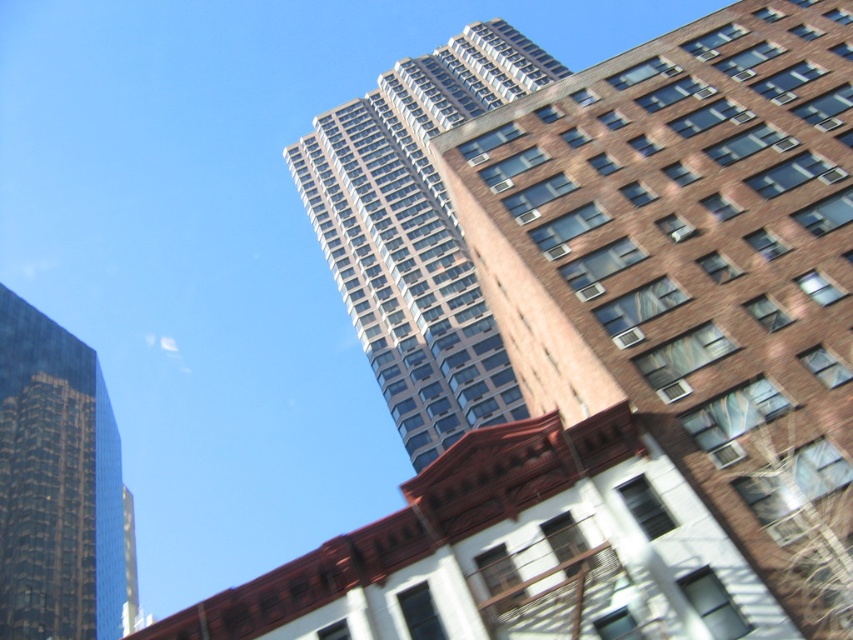
Which is behind, point (288, 156) or point (73, 401)?

Positioned behind is point (288, 156).

Can you confirm if glassy concrete skyscraper at center is smaller than shiny glass skyscraper at left?

Actually, glassy concrete skyscraper at center might be larger than shiny glass skyscraper at left.

Measure the distance between glassy concrete skyscraper at center and camera.

They are 79.69 meters apart.

This screenshot has width=853, height=640. I want to click on glassy concrete skyscraper at center, so click(416, 232).

Does point (820, 49) come behind point (9, 364)?

No.

Image resolution: width=853 pixels, height=640 pixels. Describe the element at coordinates (692, 268) in the screenshot. I see `brown brick building at upper center` at that location.

In order to click on brown brick building at upper center in this screenshot , I will do `click(692, 268)`.

Does brown brick building at upper center come in front of glassy concrete skyscraper at center?

Yes, brown brick building at upper center is closer to the viewer.

Is brown brick building at upper center behind glassy concrete skyscraper at center?

No, it is in front of glassy concrete skyscraper at center.

Between point (612, 65) and point (397, 342), which one is positioned behind?

The point (397, 342) is more distant.

Locate an element on the screen. Image resolution: width=853 pixels, height=640 pixels. brown brick building at upper center is located at coordinates (692, 268).